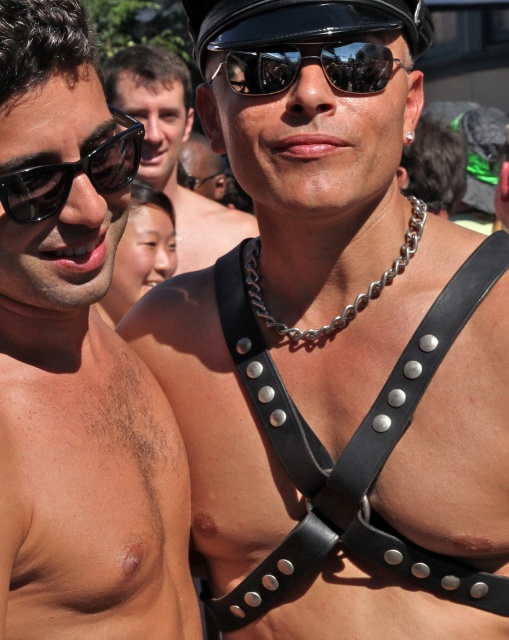
Question: Is leather harness at center thinner than black plastic sunglasses at left?

Choices:
 (A) no
 (B) yes

Answer: (A)

Question: Can you confirm if matte black sunglasses at left is bigger than black leather strap at center?

Choices:
 (A) no
 (B) yes

Answer: (B)

Question: Which object appears farthest from the camera in this image?

Choices:
 (A) black reflective sunglasses at center
 (B) black plastic sunglasses at left
 (C) black leather strap at center
 (D) matte black sunglasses at left

Answer: (C)

Question: Among these objects, which one is farthest from the camera?

Choices:
 (A) black reflective sunglasses at center
 (B) black plastic sunglasses at left
 (C) black leather strap at center

Answer: (C)

Question: Among these points, which one is nearest to the camera?

Choices:
 (A) (286, 77)
 (B) (120, 147)
 (C) (97, 172)

Answer: (C)

Question: Is leather harness at center behind silver chain necklace at center?

Choices:
 (A) no
 (B) yes

Answer: (B)